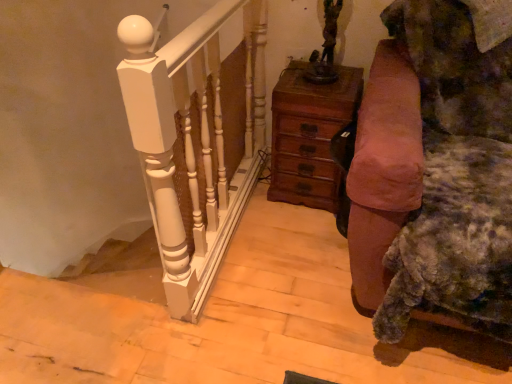
This screenshot has width=512, height=384. Identify the location of vacant space positioned to the left of velvet brown couch at right. (285, 256).